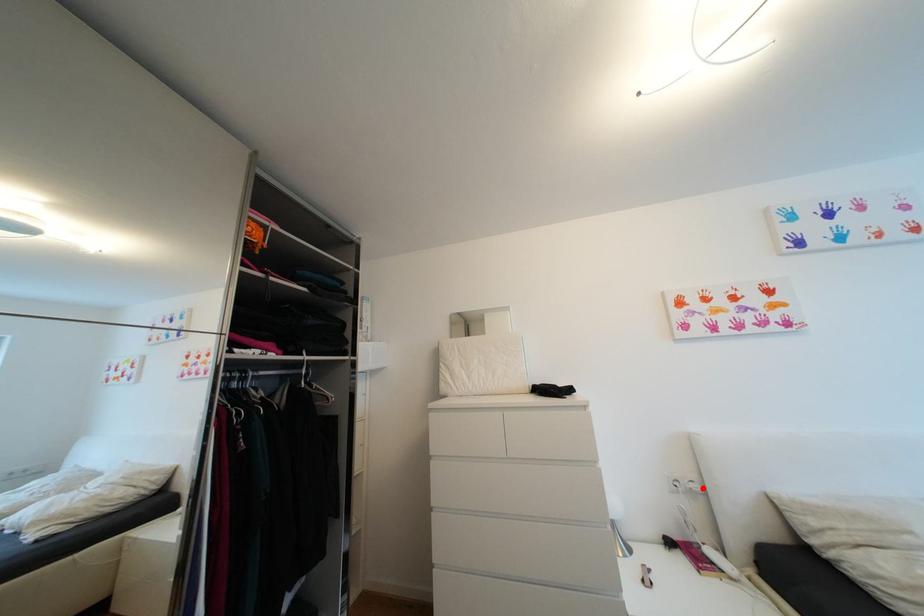
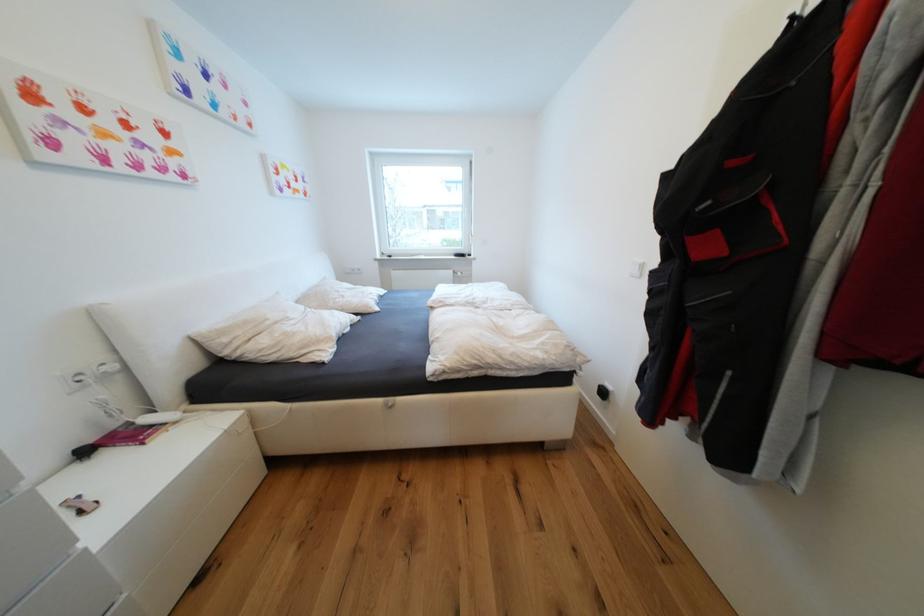
Locate, in the second image, the point that corresponds to the highlighted location in the first image.

(119, 369)